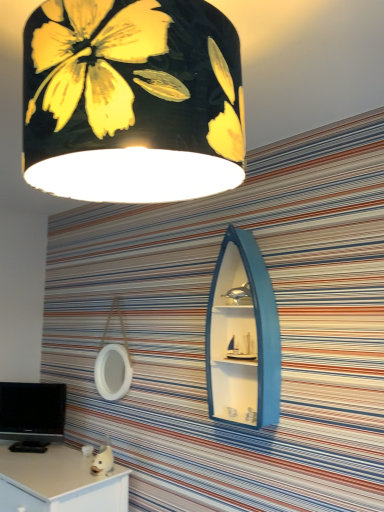
Question: Is white matte desk at lower left to the right of black glossy computer monitor at lower left from the viewer's perspective?

Choices:
 (A) no
 (B) yes

Answer: (B)

Question: Could you tell me if white matte desk at lower left is turned towards black glossy computer monitor at lower left?

Choices:
 (A) no
 (B) yes

Answer: (A)

Question: Does white matte desk at lower left come behind black glossy computer monitor at lower left?

Choices:
 (A) no
 (B) yes

Answer: (A)

Question: Considering the relative sizes of white matte desk at lower left and black glossy computer monitor at lower left in the image provided, is white matte desk at lower left shorter than black glossy computer monitor at lower left?

Choices:
 (A) no
 (B) yes

Answer: (A)

Question: Is white matte desk at lower left in front of black glossy computer monitor at lower left?

Choices:
 (A) yes
 (B) no

Answer: (A)

Question: From the image's perspective, is black glossy computer monitor at lower left located above or below blue matte boat-shaped cabinet at center?

Choices:
 (A) above
 (B) below

Answer: (B)

Question: Based on their sizes in the image, would you say black glossy computer monitor at lower left is bigger or smaller than blue matte boat-shaped cabinet at center?

Choices:
 (A) big
 (B) small

Answer: (B)

Question: Considering their positions, is black glossy computer monitor at lower left located in front of or behind blue matte boat-shaped cabinet at center?

Choices:
 (A) behind
 (B) front

Answer: (A)

Question: Is black glossy computer monitor at lower left inside or outside of blue matte boat-shaped cabinet at center?

Choices:
 (A) outside
 (B) inside

Answer: (A)

Question: Which is correct: black matte lampshade at upper center is inside blue matte boat-shaped cabinet at center, or outside of it?

Choices:
 (A) outside
 (B) inside

Answer: (A)

Question: From their relative heights in the image, would you say black matte lampshade at upper center is taller or shorter than blue matte boat-shaped cabinet at center?

Choices:
 (A) tall
 (B) short

Answer: (B)

Question: From a real-world perspective, is black matte lampshade at upper center above or below blue matte boat-shaped cabinet at center?

Choices:
 (A) above
 (B) below

Answer: (A)

Question: In terms of size, does black matte lampshade at upper center appear bigger or smaller than blue matte boat-shaped cabinet at center?

Choices:
 (A) small
 (B) big

Answer: (B)

Question: Is point (23, 395) positioned closer to the camera than point (175, 125)?

Choices:
 (A) closer
 (B) farther

Answer: (B)

Question: Considering the positions of black glossy computer monitor at lower left and black matte lampshade at upper center in the image, is black glossy computer monitor at lower left wider or thinner than black matte lampshade at upper center?

Choices:
 (A) wide
 (B) thin

Answer: (B)